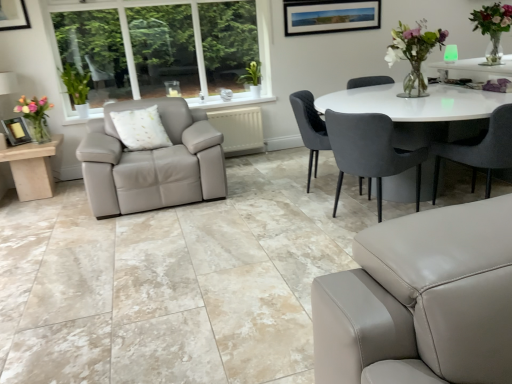
Question: Is green leafy plant at left next to matte black picture frame at lower left and touching it?

Choices:
 (A) yes
 (B) no

Answer: (B)

Question: From a real-world perspective, is green leafy plant at left located higher than matte black picture frame at lower left?

Choices:
 (A) no
 (B) yes

Answer: (B)

Question: Would you consider green leafy plant at left to be distant from matte black picture frame at lower left?

Choices:
 (A) yes
 (B) no

Answer: (B)

Question: Is green leafy plant at left bigger than matte black picture frame at lower left?

Choices:
 (A) yes
 (B) no

Answer: (A)

Question: From a real-world perspective, is green leafy plant at left below matte black picture frame at lower left?

Choices:
 (A) no
 (B) yes

Answer: (A)

Question: Would you say green leafy plant at left is inside or outside velvet grey chair at center, arranged as the 3th chair when viewed from the right?

Choices:
 (A) outside
 (B) inside

Answer: (A)

Question: Looking at the image, does green leafy plant at left seem bigger or smaller compared to velvet grey chair at center, arranged as the 3th chair when viewed from the right?

Choices:
 (A) small
 (B) big

Answer: (A)

Question: Relative to velvet grey chair at center, which is the first chair in left-to-right order, is green leafy plant at left in front or behind?

Choices:
 (A) front
 (B) behind

Answer: (B)

Question: From the image's perspective, is green leafy plant at left located above or below velvet grey chair at center, which is the first chair in left-to-right order?

Choices:
 (A) above
 (B) below

Answer: (A)

Question: From a real-world perspective, is velvet dark gray chair at center, which is the second chair from right to left, physically located above or below velvet grey chair at center, which is the first chair in left-to-right order?

Choices:
 (A) below
 (B) above

Answer: (A)

Question: Is velvet dark gray chair at center, which ranks as the second chair in left-to-right order, inside the boundaries of velvet grey chair at center, which is the first chair in left-to-right order, or outside?

Choices:
 (A) inside
 (B) outside

Answer: (B)

Question: Is point (388, 119) closer or farther from the camera than point (320, 127)?

Choices:
 (A) farther
 (B) closer

Answer: (B)

Question: Based on their positions, is velvet dark gray chair at center, which is the second chair from right to left, located to the left or right of velvet grey chair at center, which is the first chair in left-to-right order?

Choices:
 (A) right
 (B) left

Answer: (A)

Question: Is translucent glass vase at left bigger or smaller than green leafy plant at left?

Choices:
 (A) small
 (B) big

Answer: (A)

Question: In terms of height, does translucent glass vase at left look taller or shorter compared to green leafy plant at left?

Choices:
 (A) short
 (B) tall

Answer: (A)